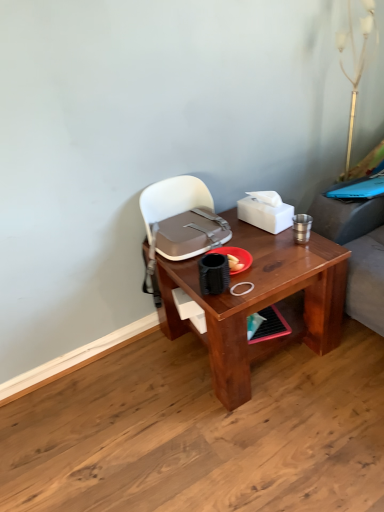
Find the location of a particular element. The image size is (384, 512). free space above brown wooden desk at center (from a real-world perspective) is located at coordinates (259, 250).